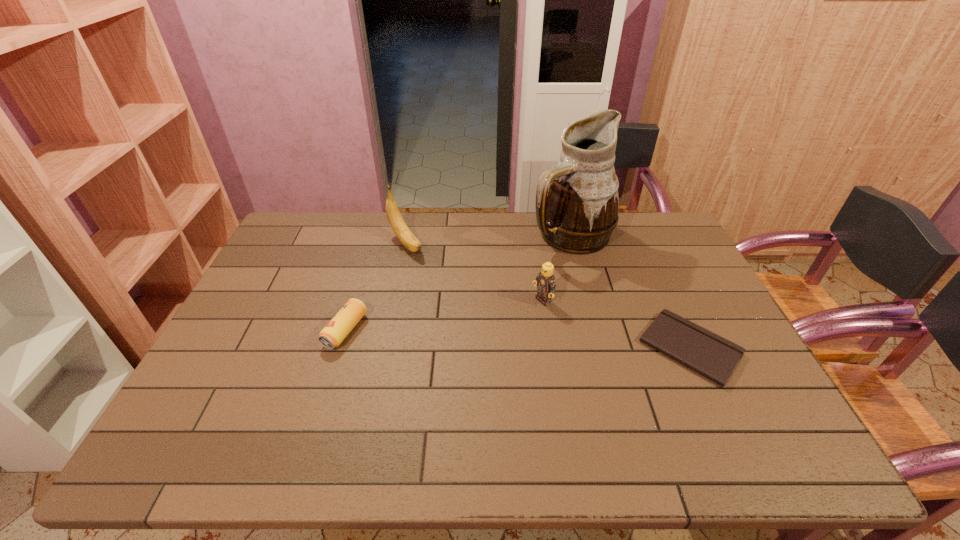
Locate an element on the screen. The height and width of the screenshot is (540, 960). object situated at the right edge is located at coordinates (712, 356).

Where is `object that is positioned at the near right corner`? The height and width of the screenshot is (540, 960). object that is positioned at the near right corner is located at coordinates (712, 356).

This screenshot has width=960, height=540. Find the location of `vacant area at the far edge of the desktop`. vacant area at the far edge of the desktop is located at coordinates (352, 238).

The height and width of the screenshot is (540, 960). In the image, there is a desktop. What are the coordinates of `free space at the near edge` in the screenshot? It's located at (548, 395).

Identify the location of free region at the right edge of the desktop. (721, 317).

Find the location of a particular element. free spot at the far left corner of the desktop is located at coordinates (295, 220).

The image size is (960, 540). Find the location of `vacant space at the far right corner of the desktop`. vacant space at the far right corner of the desktop is located at coordinates (660, 218).

You are a GUI agent. You are given a task and a screenshot of the screen. Output one action in this format:
    pyautogui.click(x=<x>, y=<y>)
    Task: Click on the vacant area that lies between the Lego and the checkbook
    This screenshot has height=540, width=960.
    Given the screenshot: What is the action you would take?
    point(616,325)

Where is `free space between the second shortest object and the tallest object`? The image size is (960, 540). free space between the second shortest object and the tallest object is located at coordinates (458, 283).

Where is `vacant space that's between the shortest object and the third tallest object`? This screenshot has width=960, height=540. vacant space that's between the shortest object and the third tallest object is located at coordinates (616, 325).